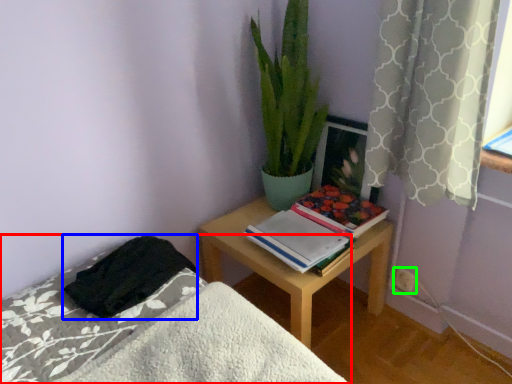
Question: Considering the real-world distances, which object is farthest from bed (highlighted by a red box)? blanket (highlighted by a blue box) or electric outlet (highlighted by a green box)?

Choices:
 (A) blanket
 (B) electric outlet

Answer: (B)